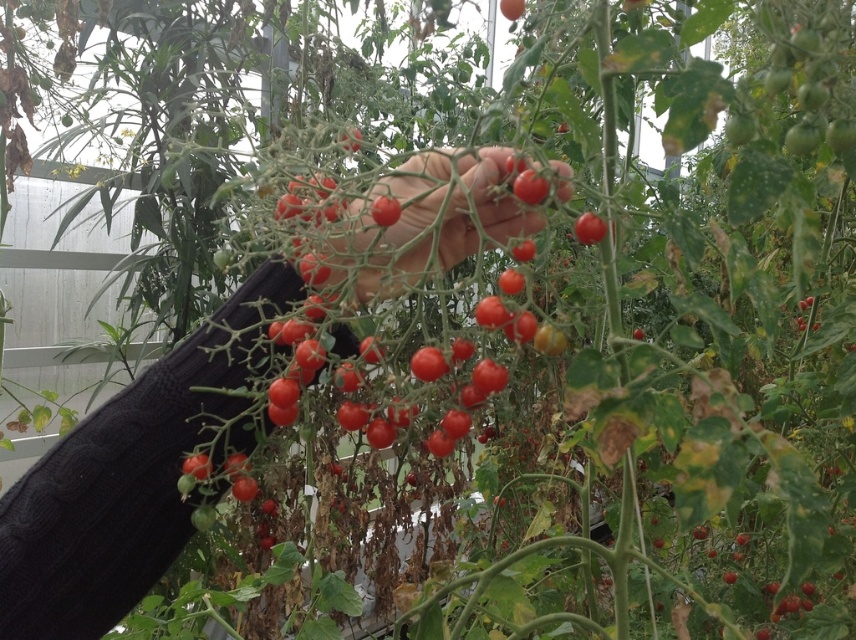
You are a gardener trying to harvest the glossy red tomato at center. The smooth skin hand at center needs to grasp it without damaging the plant. Given their sizes, is the hand capable of fully enclosing the tomato?

The smooth skin hand at center is larger in size than the glossy red tomato at center, so yes, the hand can fully enclose the tomato without causing damage to the plant.